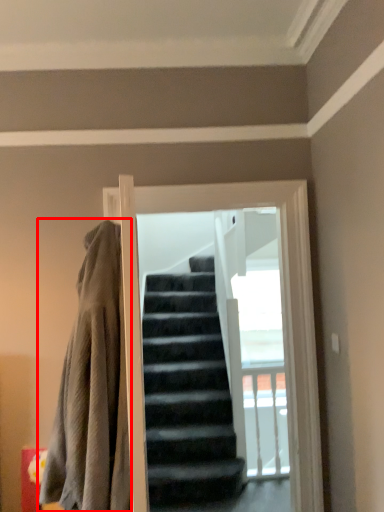
Question: From the image's perspective, where is blanket (annotated by the red box) located in relation to screen door in the image?

Choices:
 (A) above
 (B) below

Answer: (B)